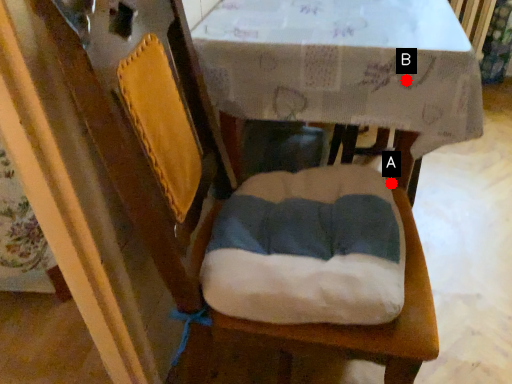
Question: Two points are circled on the image, labeled by A and B beside each circle. Among these points, which one is farthest from the camera?

Choices:
 (A) A is further
 (B) B is further

Answer: (A)